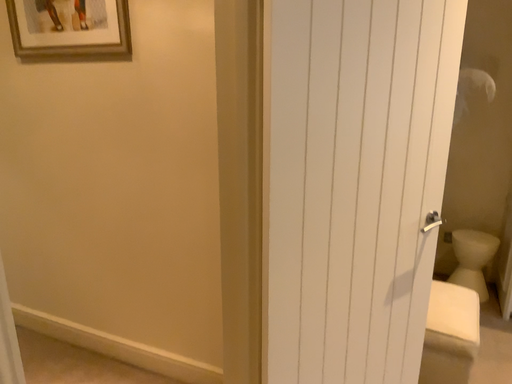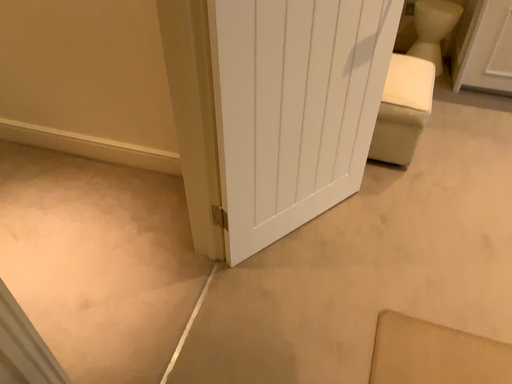
Question: Which way did the camera rotate in the video?

Choices:
 (A) rotated upward
 (B) rotated downward

Answer: (B)